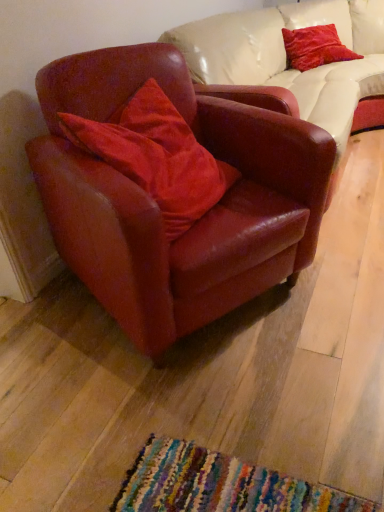
Find the location of `free space in front of leather armchair at left`. free space in front of leather armchair at left is located at coordinates (198, 416).